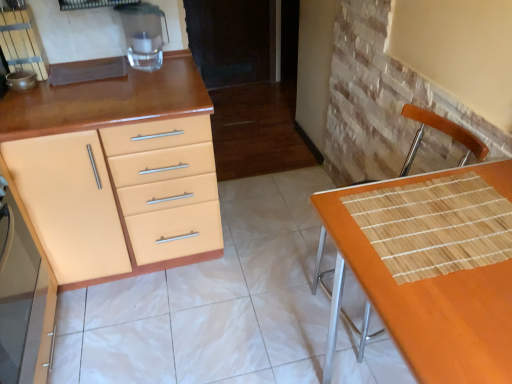
In order to click on matte orange cabinet at left, acting as the second cabinetry starting from the front in this screenshot , I will do `click(106, 170)`.

What do you see at coordinates (432, 267) in the screenshot?
I see `orange woven mat at lower right` at bounding box center [432, 267].

The height and width of the screenshot is (384, 512). In order to click on transparent glass water at upper left in this screenshot , I will do `click(143, 34)`.

In the image, there is a matte beige cabinet at left, the 2th cabinetry from the back. Identify the location of table below it (from a real-world perspective). The image size is (512, 384). (432, 267).

Would you say matte beige cabinet at left, the 2th cabinetry from the back, is inside or outside orange woven mat at lower right?

matte beige cabinet at left, the 2th cabinetry from the back, is outside orange woven mat at lower right.

Considering the sizes of objects matte beige cabinet at left, the 2th cabinetry from the back, and orange woven mat at lower right in the image provided, who is wider, matte beige cabinet at left, the 2th cabinetry from the back, or orange woven mat at lower right?

With larger width is orange woven mat at lower right.

Are matte orange cabinet at left, the 1th cabinetry from the back, and matte beige cabinet at left, the 2th cabinetry from the back, making contact?

No, matte orange cabinet at left, the 1th cabinetry from the back, is not making contact with matte beige cabinet at left, the 2th cabinetry from the back.

Between matte orange cabinet at left, the 1th cabinetry from the back, and matte beige cabinet at left, the first cabinetry viewed from the front, which one has smaller size?

With smaller size is matte beige cabinet at left, the first cabinetry viewed from the front.

Is point (121, 157) positioned after point (36, 299)?

No, it is not.

Considering the sizes of matte orange cabinet at left, the 1th cabinetry from the back, and matte beige cabinet at left, the first cabinetry viewed from the front, in the image, is matte orange cabinet at left, the 1th cabinetry from the back, wider or thinner than matte beige cabinet at left, the first cabinetry viewed from the front,?

In the image, matte orange cabinet at left, the 1th cabinetry from the back, appears to be wider than matte beige cabinet at left, the first cabinetry viewed from the front.

Can you confirm if transparent glass water at upper left is bigger than matte orange cabinet at left, acting as the second cabinetry starting from the front?

No.

Is transparent glass water at upper left positioned behind matte orange cabinet at left, acting as the second cabinetry starting from the front?

Yes.

From the image's perspective, between transparent glass water at upper left and matte orange cabinet at left, acting as the second cabinetry starting from the front, who is located below?

matte orange cabinet at left, acting as the second cabinetry starting from the front.

How far apart are transparent glass water at upper left and matte orange cabinet at left, the 1th cabinetry from the back?

The distance of transparent glass water at upper left from matte orange cabinet at left, the 1th cabinetry from the back, is 21.08 inches.

From the image's perspective, is orange woven mat at lower right over matte orange cabinet at left, the 1th cabinetry from the back?

No, from the image's perspective, orange woven mat at lower right is not above matte orange cabinet at left, the 1th cabinetry from the back.

In the scene shown: Considering the sizes of orange woven mat at lower right and matte orange cabinet at left, the 1th cabinetry from the back, in the image, is orange woven mat at lower right taller or shorter than matte orange cabinet at left, the 1th cabinetry from the back,?

In the image, orange woven mat at lower right appears to be shorter than matte orange cabinet at left, the 1th cabinetry from the back.

Does orange woven mat at lower right come behind matte orange cabinet at left, the 1th cabinetry from the back?

No.

Based on the photo, does orange woven mat at lower right appear on the left side of matte orange cabinet at left, acting as the second cabinetry starting from the front?

In fact, orange woven mat at lower right is to the right of matte orange cabinet at left, acting as the second cabinetry starting from the front.

How distant is transparent glass water at upper left from matte beige cabinet at left, the 2th cabinetry from the back?

A distance of 37.42 inches exists between transparent glass water at upper left and matte beige cabinet at left, the 2th cabinetry from the back.

Considering the relative sizes of transparent glass water at upper left and matte beige cabinet at left, the 2th cabinetry from the back, in the image provided, is transparent glass water at upper left wider than matte beige cabinet at left, the 2th cabinetry from the back,?

Correct, the width of transparent glass water at upper left exceeds that of matte beige cabinet at left, the 2th cabinetry from the back.

From a real-world perspective, is transparent glass water at upper left above or below matte beige cabinet at left, the first cabinetry viewed from the front?

From a real-world perspective, transparent glass water at upper left is physically above matte beige cabinet at left, the first cabinetry viewed from the front.

Is transparent glass water at upper left turned away from matte beige cabinet at left, the first cabinetry viewed from the front?

No, transparent glass water at upper left is not facing the opposite direction of matte beige cabinet at left, the first cabinetry viewed from the front.

From a real-world perspective, relative to transparent glass water at upper left, is matte beige cabinet at left, the 2th cabinetry from the back, vertically above or below?

matte beige cabinet at left, the 2th cabinetry from the back, is situated lower than transparent glass water at upper left in the real world.

Can you see matte beige cabinet at left, the first cabinetry viewed from the front, touching transparent glass water at upper left?

matte beige cabinet at left, the first cabinetry viewed from the front, is not next to transparent glass water at upper left, and they're not touching.

Who is more distant, matte beige cabinet at left, the 2th cabinetry from the back, or transparent glass water at upper left?

transparent glass water at upper left is more distant.

Does transparent glass water at upper left have a greater height compared to orange woven mat at lower right?

No.

Which is correct: transparent glass water at upper left is inside orange woven mat at lower right, or outside of it?

transparent glass water at upper left lies outside orange woven mat at lower right.

Consider the image. How different are the orientations of transparent glass water at upper left and orange woven mat at lower right in degrees?

89.1 degrees.

Which object is positioned more to the left, transparent glass water at upper left or orange woven mat at lower right?

Positioned to the left is transparent glass water at upper left.

Image resolution: width=512 pixels, height=384 pixels. In order to click on table below the matte beige cabinet at left, the 2th cabinetry from the back (from a real-world perspective) in this screenshot , I will do `click(432, 267)`.

Identify the location of cabinetry above the matte beige cabinet at left, the first cabinetry viewed from the front (from the image's perspective). (106, 170).

From the image, which object appears to be farther from orange woven mat at lower right, transparent glass water at upper left or matte orange cabinet at left, acting as the second cabinetry starting from the front?

The object further to orange woven mat at lower right is transparent glass water at upper left.

Which object lies further to the anchor point orange woven mat at lower right, matte orange cabinet at left, the 1th cabinetry from the back, or matte beige cabinet at left, the first cabinetry viewed from the front?

Among the two, matte beige cabinet at left, the first cabinetry viewed from the front, is located further to orange woven mat at lower right.

When comparing their distances from matte beige cabinet at left, the first cabinetry viewed from the front, does orange woven mat at lower right or transparent glass water at upper left seem further?

orange woven mat at lower right is further to matte beige cabinet at left, the first cabinetry viewed from the front.

Estimate the real-world distances between objects in this image. Which object is closer to matte orange cabinet at left, acting as the second cabinetry starting from the front, transparent glass water at upper left or orange woven mat at lower right?

transparent glass water at upper left is positioned closer to the anchor matte orange cabinet at left, acting as the second cabinetry starting from the front.

From the image, which object appears to be nearer to orange woven mat at lower right, matte beige cabinet at left, the 2th cabinetry from the back, or matte orange cabinet at left, the 1th cabinetry from the back?

matte orange cabinet at left, the 1th cabinetry from the back.

From the image, which object appears to be nearer to transparent glass water at upper left, orange woven mat at lower right or matte beige cabinet at left, the 2th cabinetry from the back?

Among the two, matte beige cabinet at left, the 2th cabinetry from the back, is located nearer to transparent glass water at upper left.

Considering their positions, is transparent glass water at upper left positioned closer to matte orange cabinet at left, the 1th cabinetry from the back, than matte beige cabinet at left, the first cabinetry viewed from the front?

matte beige cabinet at left, the first cabinetry viewed from the front, lies closer to matte orange cabinet at left, the 1th cabinetry from the back, than the other object.

From the image, which object appears to be nearer to orange woven mat at lower right, matte orange cabinet at left, the 1th cabinetry from the back, or transparent glass water at upper left?

matte orange cabinet at left, the 1th cabinetry from the back, is closer to orange woven mat at lower right.

Where is `appliance between matte beige cabinet at left, the first cabinetry viewed from the front, and orange woven mat at lower right, in the horizontal direction`? The width and height of the screenshot is (512, 384). appliance between matte beige cabinet at left, the first cabinetry viewed from the front, and orange woven mat at lower right, in the horizontal direction is located at coordinates 143,34.

Locate an element on the screen. The height and width of the screenshot is (384, 512). cabinetry between matte beige cabinet at left, the 2th cabinetry from the back, and orange woven mat at lower right is located at coordinates (106, 170).

What are the coordinates of `appliance between matte orange cabinet at left, the 1th cabinetry from the back, and orange woven mat at lower right, in the horizontal direction` in the screenshot? It's located at [x=143, y=34].

Locate an element on the screen. This screenshot has width=512, height=384. cabinetry that lies between transparent glass water at upper left and matte beige cabinet at left, the first cabinetry viewed from the front, from top to bottom is located at coordinates (106, 170).